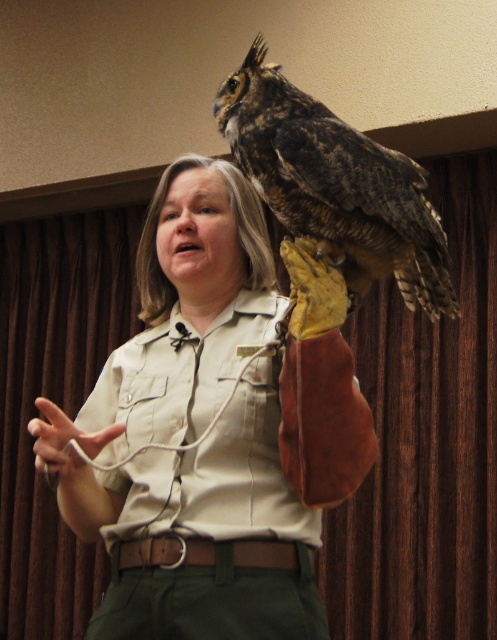
You are a photographer standing 2 meters away from the camera. You want to take a closeup photo of the brown feathered owl at upper center. The camera has a minimum focusing distance of 1.5 meters. Can you take the photo without moving closer?

The distance of brown feathered owl at upper center from camera is 1.44 meters, which is less than the camera minimum focusing distance of 1.5 meters. Therefore, you cannot take the photo without moving closer.

You are organizing a wildlife presentation and need to place two gloves on a table. The gloves are the brown leather glove at upper right and the leather glove at upper center. If the table can only accommodate items within a 4 inch space, will both gloves fit together on the table?

The distance between the brown leather glove at upper right and the leather glove at upper center is 4.13 inches, which is slightly more than the 4 inch space available. Therefore, the two gloves cannot fit together on the table.